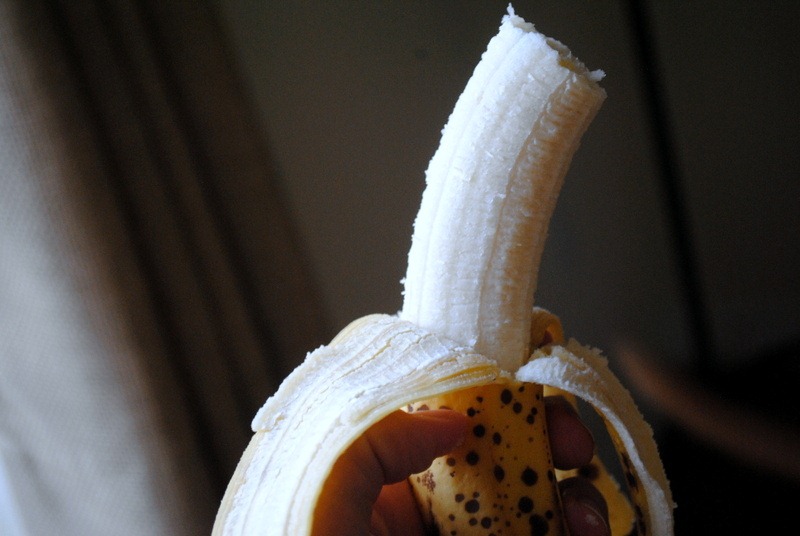
Locate an element on the screen. The image size is (800, 536). curtain is located at coordinates (54, 282).